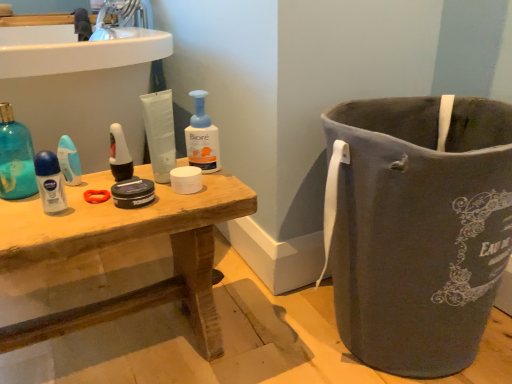
Locate an element on the screen. vacant space to the left of white matte toilet paper at center is located at coordinates (98, 191).